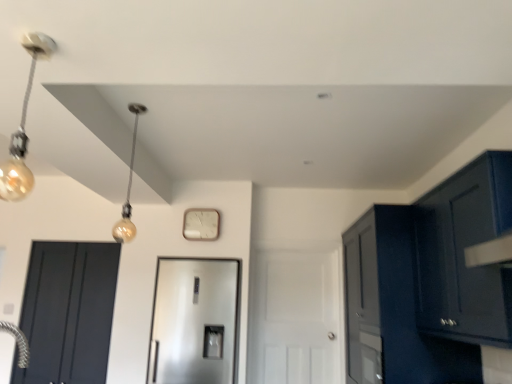
Question: Considering the relative sizes of matte black door at left, the 3th door viewed from the right, and satin silver refrigerator at center, which is the second door from right to left, in the image provided, is matte black door at left, the 3th door viewed from the right, taller than satin silver refrigerator at center, which is the second door from right to left,?

Choices:
 (A) no
 (B) yes

Answer: (B)

Question: Is matte black door at left, the 1th door positioned from the left, thinner than satin silver refrigerator at center, which is the second door from right to left?

Choices:
 (A) yes
 (B) no

Answer: (A)

Question: Does matte black door at left, the 3th door viewed from the right, come in front of satin silver refrigerator at center, placed as the second door when sorted from left to right?

Choices:
 (A) yes
 (B) no

Answer: (B)

Question: Would you say matte black door at left, the 1th door positioned from the left, contains satin silver refrigerator at center, placed as the second door when sorted from left to right?

Choices:
 (A) no
 (B) yes

Answer: (A)

Question: Is matte black door at left, the 3th door viewed from the right, far away from satin silver refrigerator at center, which is the second door from right to left?

Choices:
 (A) no
 (B) yes

Answer: (A)

Question: Is glossy dark blue cabinet at upper right, which is the second cabinetry in back-to-front order, wider or thinner than glossy dark blue cabinet at right, the 1th cabinetry from the back?

Choices:
 (A) wide
 (B) thin

Answer: (B)

Question: Would you say glossy dark blue cabinet at upper right, which is the first cabinetry from front to back, is to the left or to the right of glossy dark blue cabinet at right, the 1th cabinetry from the back, in the picture?

Choices:
 (A) left
 (B) right

Answer: (B)

Question: From the image's perspective, relative to glossy dark blue cabinet at right, the 1th cabinetry from the back, is glossy dark blue cabinet at upper right, which is the second cabinetry in back-to-front order, above or below?

Choices:
 (A) below
 (B) above

Answer: (B)

Question: From a real-world perspective, relative to glossy dark blue cabinet at right, the 1th cabinetry from the back, is glossy dark blue cabinet at upper right, which is the first cabinetry from front to back, vertically above or below?

Choices:
 (A) above
 (B) below

Answer: (A)

Question: Is matte gold bulb at upper left inside or outside of glossy dark blue cabinet at right, which is the 2th cabinetry in front-to-back order?

Choices:
 (A) outside
 (B) inside

Answer: (A)

Question: From the image's perspective, relative to glossy dark blue cabinet at right, the 1th cabinetry from the back, is matte gold bulb at upper left above or below?

Choices:
 (A) above
 (B) below

Answer: (A)

Question: From their relative heights in the image, would you say matte gold bulb at upper left is taller or shorter than glossy dark blue cabinet at right, which is the 2th cabinetry in front-to-back order?

Choices:
 (A) short
 (B) tall

Answer: (A)

Question: Based on their sizes in the image, would you say matte gold bulb at upper left is bigger or smaller than glossy dark blue cabinet at right, the 1th cabinetry from the back?

Choices:
 (A) small
 (B) big

Answer: (A)

Question: In the image, is glossy dark blue cabinet at upper right, which is the second cabinetry in back-to-front order, on the left side or the right side of white matte door at center, the 3th door in the left-to-right sequence?

Choices:
 (A) right
 (B) left

Answer: (A)

Question: Considering the positions of glossy dark blue cabinet at upper right, which is the second cabinetry in back-to-front order, and white matte door at center, the 3th door in the left-to-right sequence, in the image, is glossy dark blue cabinet at upper right, which is the second cabinetry in back-to-front order, bigger or smaller than white matte door at center, the 3th door in the left-to-right sequence,?

Choices:
 (A) small
 (B) big

Answer: (B)